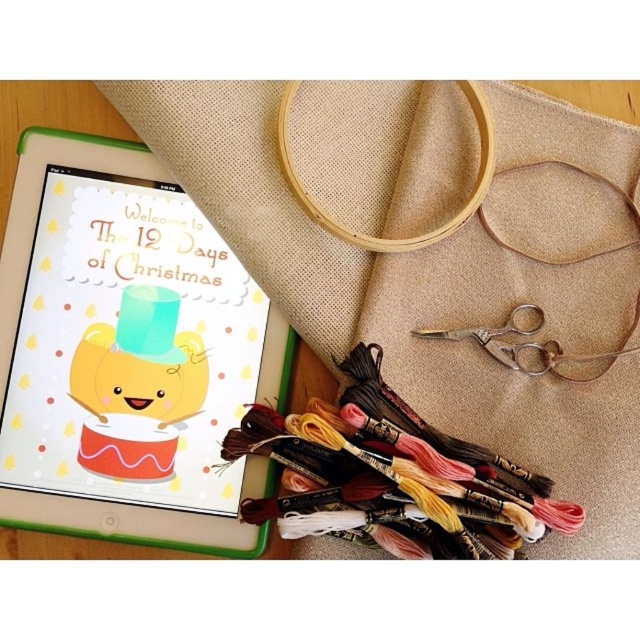
Does beige fabric at upper center come in front of antique brass scissors at center?

Yes, it is.

Can you confirm if beige fabric at upper center is positioned below antique brass scissors at center?

Actually, beige fabric at upper center is above antique brass scissors at center.

Find the location of `beige fabric at upper center`. beige fabric at upper center is located at coordinates (438, 252).